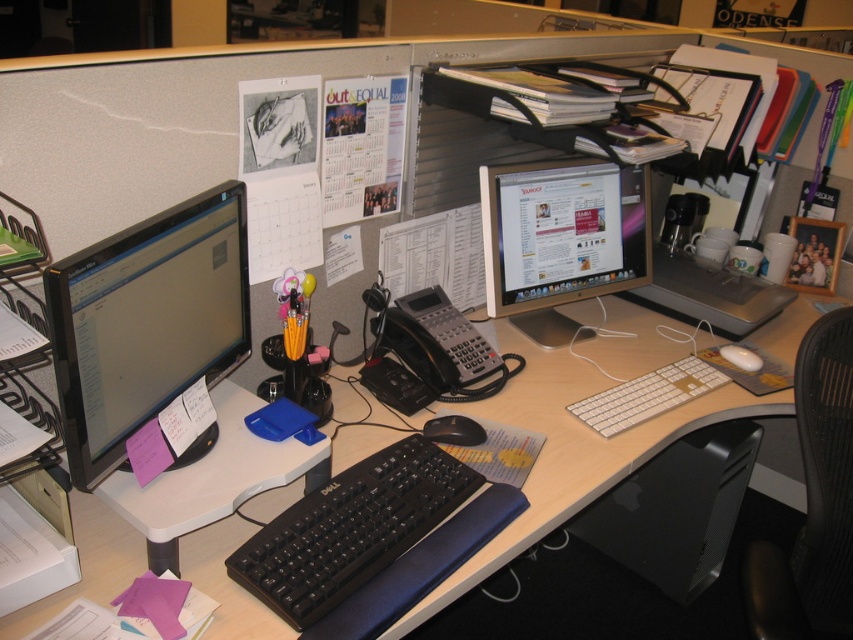
You need to place a new phone charger on the desk without blocking the keyboard or mouse. Considering the size of the black plastic computer desk at center and the black matte mouse at center, where should you place it?

The black plastic computer computer desk at center is larger than the black matte mouse at center, so you can place the charger on the desk away from the keyboard and mouse areas to avoid blocking them.

You are an office worker who needs to place a new phone charger on the desk. The charger is 10 cm long. You want to place it between the matte black monitor at left and the black matte mouse at center. Is there enough space?

The matte black monitor at left is larger in size than the black matte mouse at center, but the exact distance between them isn not provided. Therefore, it is uncertain if there is enough space for the 10 cm charger.